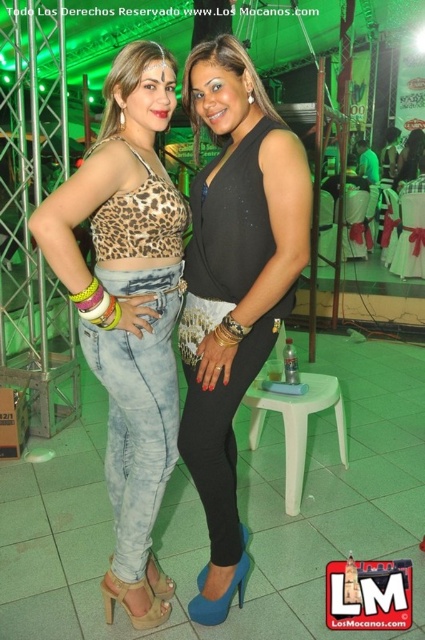
Question: Which point is closer to the camera?

Choices:
 (A) (125, 468)
 (B) (254, 134)
 (C) (339, 403)

Answer: (B)

Question: Where is black shiny dress at center located in relation to light green plastic stool at center in the image?

Choices:
 (A) above
 (B) below

Answer: (A)

Question: Is black shiny dress at center smaller than light green plastic stool at center?

Choices:
 (A) yes
 (B) no

Answer: (B)

Question: Among these points, which one is farthest from the camera?

Choices:
 (A) (200, 593)
 (B) (289, 468)
 (C) (113, 234)

Answer: (B)

Question: Can you confirm if leopard print fabric top at center is bigger than black shiny dress at center?

Choices:
 (A) no
 (B) yes

Answer: (B)

Question: Which of the following is the closest to the observer?

Choices:
 (A) leopard print fabric top at center
 (B) light green plastic stool at center

Answer: (A)